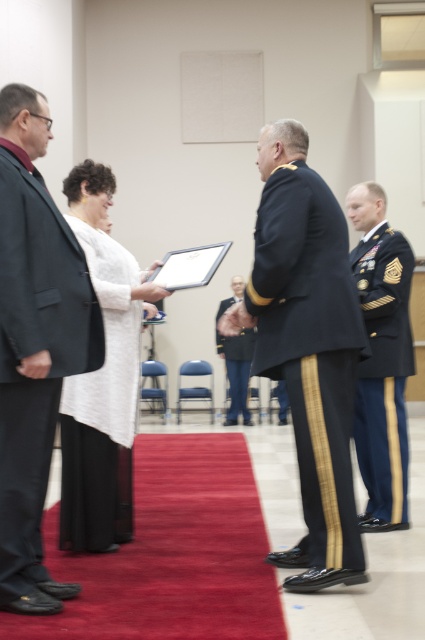
Question: Does navy blue fabric uniform at center appear on the left side of velvet gold uniform at center?

Choices:
 (A) yes
 (B) no

Answer: (B)

Question: Considering the relative positions of dark green military uniform at right and velvet gold uniform at center in the image provided, where is dark green military uniform at right located with respect to velvet gold uniform at center?

Choices:
 (A) below
 (B) above

Answer: (B)

Question: Among these points, which one is farthest from the camera?

Choices:
 (A) (2, 240)
 (B) (370, 497)
 (C) (221, 342)

Answer: (C)

Question: Does navy blue fabric uniform at center have a larger size compared to white matte jacket at center?

Choices:
 (A) yes
 (B) no

Answer: (B)

Question: Which point is closer to the camera?

Choices:
 (A) black matte suit at left
 (B) white matte jacket at center
 (C) velvet gold uniform at center

Answer: (A)

Question: Which point appears closest to the camera in this image?

Choices:
 (A) (59, 602)
 (B) (317, 202)
 (C) (376, 429)

Answer: (A)